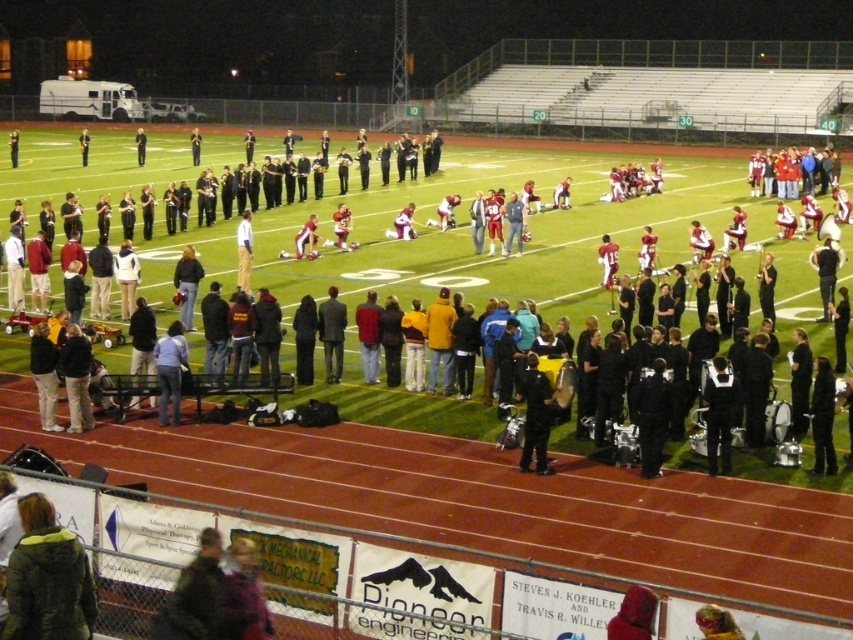
Question: Does light blue shirt at center appear on the right side of black leather jacket at center?

Choices:
 (A) no
 (B) yes

Answer: (B)

Question: Can you confirm if light blue shirt at center is positioned to the right of matte black uniform at center?

Choices:
 (A) yes
 (B) no

Answer: (A)

Question: Which point appears closest to the camera in this image?

Choices:
 (A) (535, 444)
 (B) (136, 131)

Answer: (A)

Question: Which point is closer to the camera?

Choices:
 (A) [746, 180]
 (B) [35, 524]

Answer: (B)

Question: Is black uniform at center bigger than light blue shirt at center?

Choices:
 (A) no
 (B) yes

Answer: (A)

Question: Which object is the closest to the black uniform at center?

Choices:
 (A) matte black uniform at center
 (B) black uniform at lower right

Answer: (B)